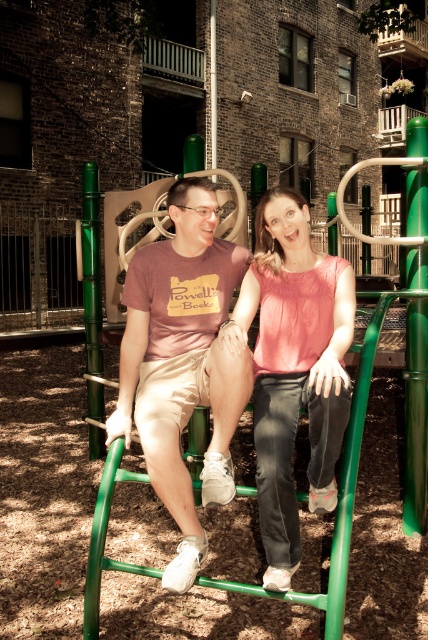
Which is above, matte pink t-shirt at center or matte pink blouse at center?

matte pink t-shirt at center is higher up.

Who is more distant from viewer, (210, 493) or (285, 564)?

The point (210, 493) is behind.

Where is `matte pink t-shirt at center`? matte pink t-shirt at center is located at coordinates (183, 362).